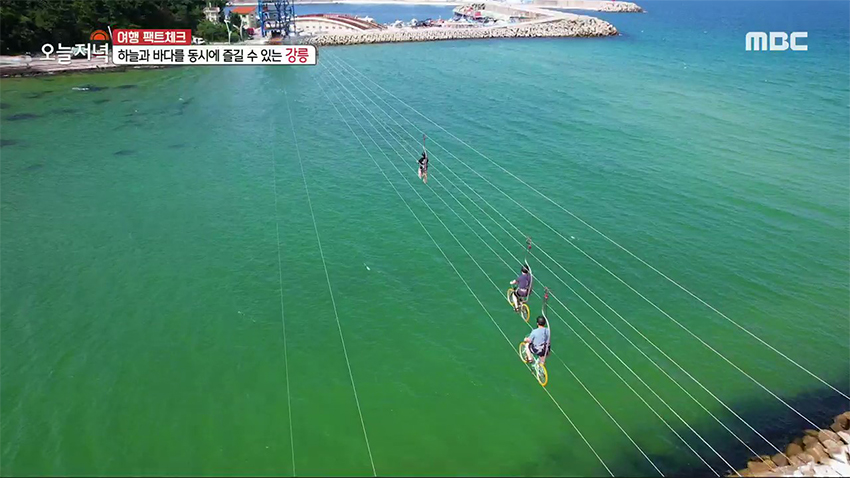
Find the location of `cable`. cable is located at coordinates pos(735,418).